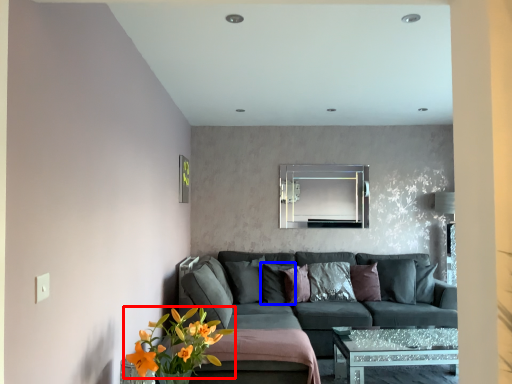
Question: Which object is further to the camera taking this photo, flower (highlighted by a red box) or pillow (highlighted by a blue box)?

Choices:
 (A) flower
 (B) pillow

Answer: (B)